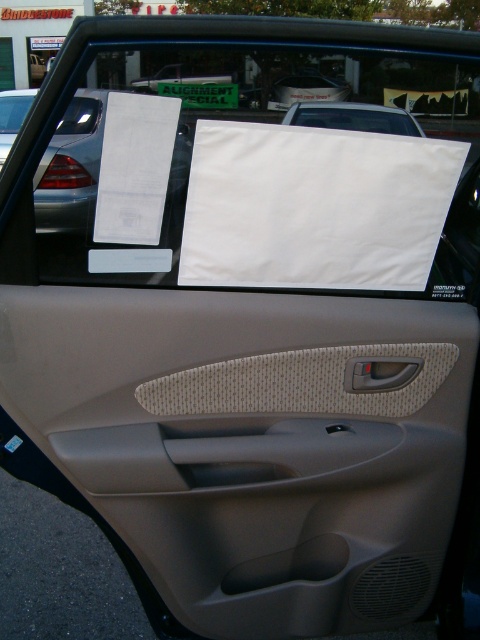
Question: Where is beige textured door handle at center located in relation to beige fabric door at center in the image?

Choices:
 (A) left
 (B) right

Answer: (B)

Question: Is beige textured door handle at center bigger than beige fabric door at center?

Choices:
 (A) yes
 (B) no

Answer: (B)

Question: Which of the following is the farthest from the observer?

Choices:
 (A) beige textured door handle at center
 (B) beige fabric door at center

Answer: (B)

Question: Can you confirm if beige textured door handle at center is positioned to the left of beige fabric door at center?

Choices:
 (A) yes
 (B) no

Answer: (B)

Question: Among these objects, which one is nearest to the camera?

Choices:
 (A) beige textured door handle at center
 (B) beige fabric door at center

Answer: (A)